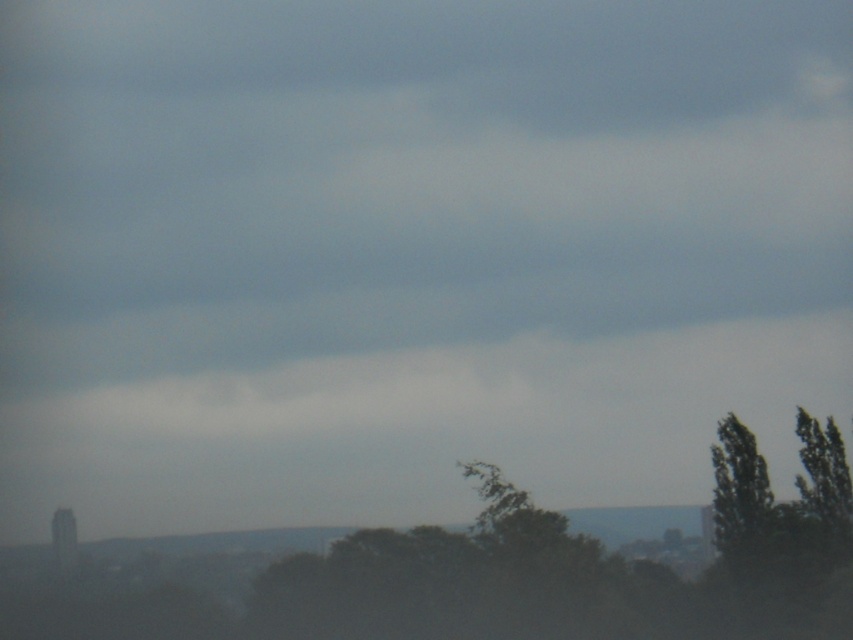
Question: Among these points, which one is farthest from the camera?

Choices:
 (A) (845, 522)
 (B) (740, 545)

Answer: (B)

Question: Which point appears closest to the camera in this image?

Choices:
 (A) (755, 525)
 (B) (282, 580)

Answer: (B)

Question: Where is green matte tree at center located in relation to green leafy tree at right in the image?

Choices:
 (A) left
 (B) right

Answer: (A)

Question: Can you confirm if green matte tree at center is wider than green leafy tree at right?

Choices:
 (A) yes
 (B) no

Answer: (A)

Question: Is green matte tree at center thinner than green leafy tree at right?

Choices:
 (A) no
 (B) yes

Answer: (A)